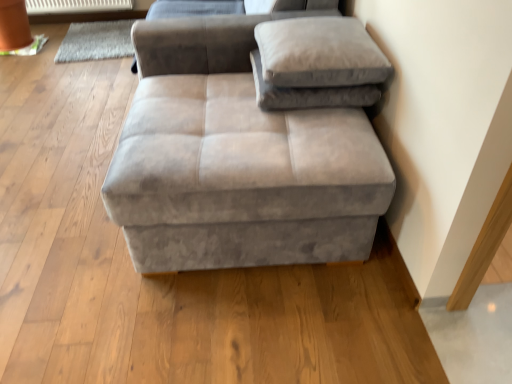
The height and width of the screenshot is (384, 512). Find the location of `free spot in front of gray woolen mat at upper left`. free spot in front of gray woolen mat at upper left is located at coordinates (68, 76).